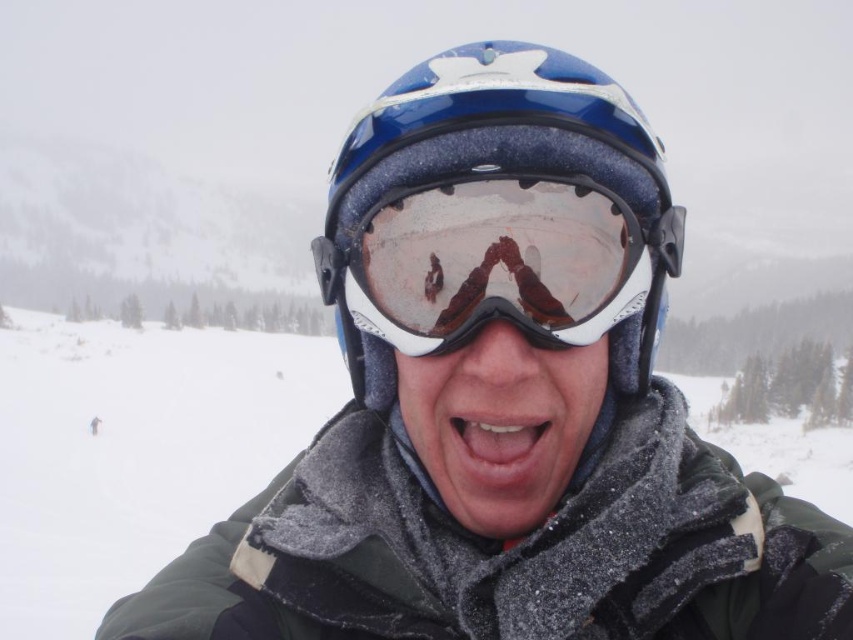
Does transparent plastic goggles at center have a lesser width compared to smooth skin mouth at center?

Incorrect, transparent plastic goggles at center's width is not less than smooth skin mouth at center's.

Is transparent plastic goggles at center positioned before smooth skin mouth at center?

Yes.

What are the coordinates of `transparent plastic goggles at center` in the screenshot? It's located at (497, 260).

Is transparent plastic goggles at center behind satin white goggles at center?

No, transparent plastic goggles at center is in front of satin white goggles at center.

Which is in front, point (381, 280) or point (538, 436)?

Point (381, 280) is in front.

Which is in front, point (592, 184) or point (605, 385)?

Point (592, 184) is more forward.

I want to click on transparent plastic goggles at center, so click(x=497, y=260).

From the picture: Can you confirm if blue matte helmet at center is positioned to the right of transparent plastic goggles at center?

Yes, blue matte helmet at center is to the right of transparent plastic goggles at center.

Is point (451, 339) farther from camera compared to point (497, 260)?

Yes.

Where is `blue matte helmet at center`? The width and height of the screenshot is (853, 640). blue matte helmet at center is located at coordinates (498, 252).